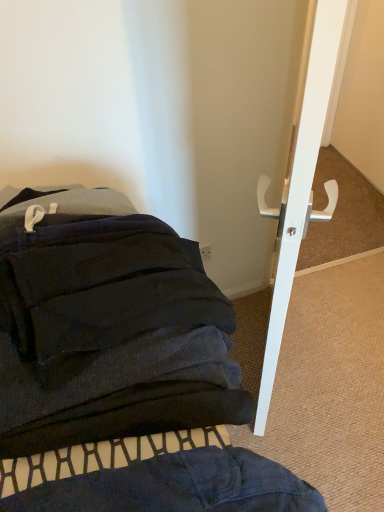
Question: Is dark blue fabric at lower left taller or shorter than white glossy door handle at upper right?

Choices:
 (A) short
 (B) tall

Answer: (A)

Question: From a real-world perspective, is dark blue fabric at lower left physically located above or below white glossy door handle at upper right?

Choices:
 (A) above
 (B) below

Answer: (B)

Question: Which is correct: dark blue fabric at lower left is inside white glossy door handle at upper right, or outside of it?

Choices:
 (A) inside
 (B) outside

Answer: (B)

Question: From the image's perspective, is white glossy door handle at upper right located above or below dark blue fabric at lower left?

Choices:
 (A) above
 (B) below

Answer: (A)

Question: Relative to dark blue fabric at lower left, is white glossy door handle at upper right in front or behind?

Choices:
 (A) behind
 (B) front

Answer: (A)

Question: In the image, is white glossy door handle at upper right on the left side or the right side of dark blue fabric at lower left?

Choices:
 (A) right
 (B) left

Answer: (A)

Question: From a real-world perspective, relative to dark blue fabric at lower left, is white glossy door handle at upper right vertically above or below?

Choices:
 (A) above
 (B) below

Answer: (A)